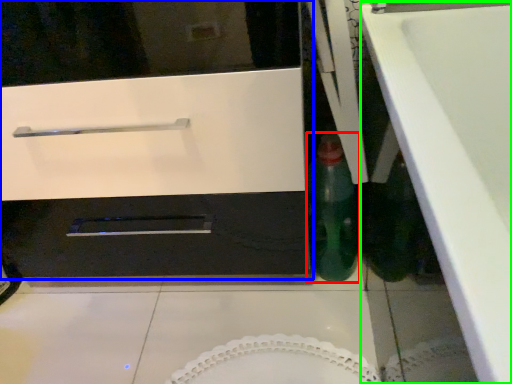
Question: Which object is the farthest from bottle (highlighted by a red box)? Choose among these: oven (highlighted by a blue box) or counter top (highlighted by a green box).

Choices:
 (A) oven
 (B) counter top

Answer: (B)